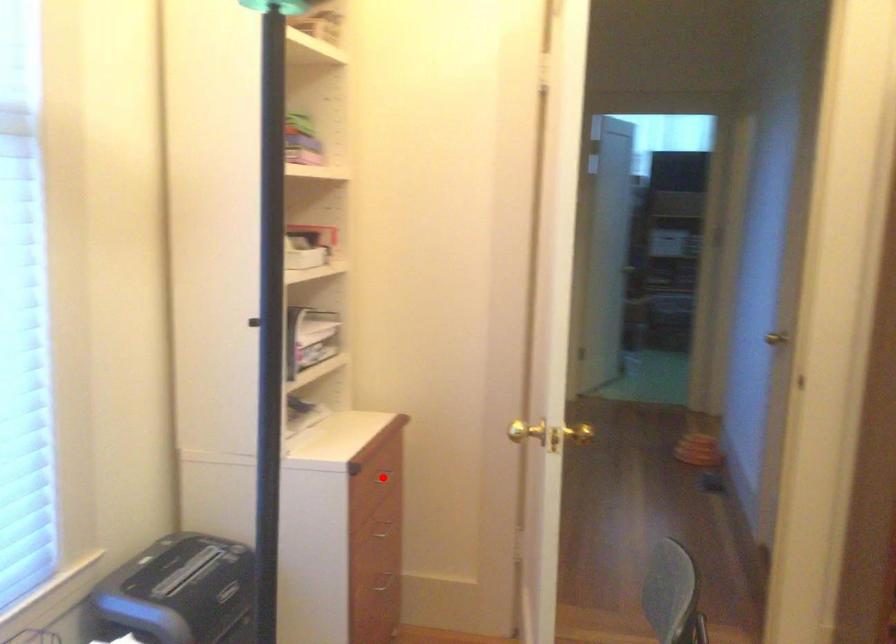
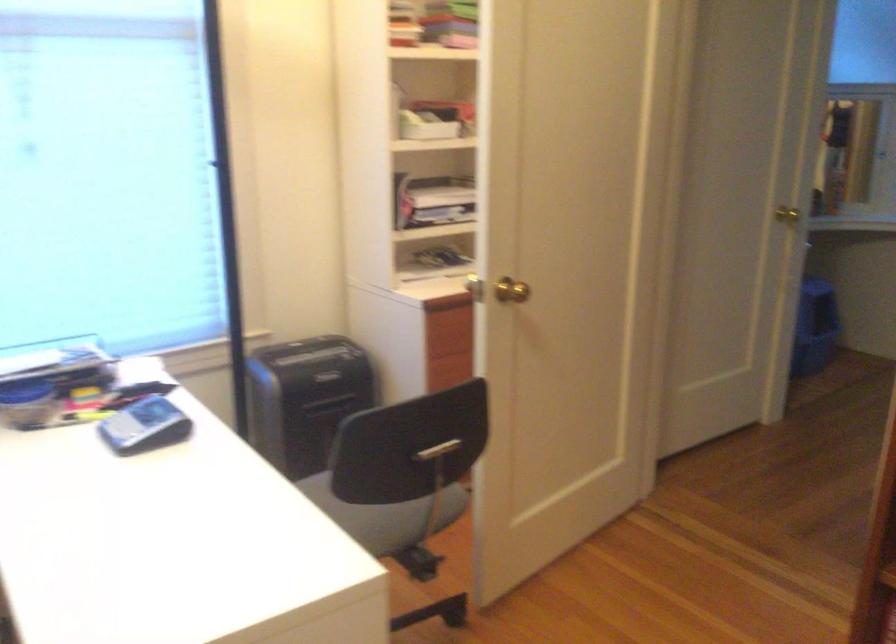
Question: I am providing you with two images of the same scene from different viewpoints. A red point is marked on the first image. Is the red point's position out of view in image 2?

Choices:
 (A) Yes
 (B) No

Answer: (A)